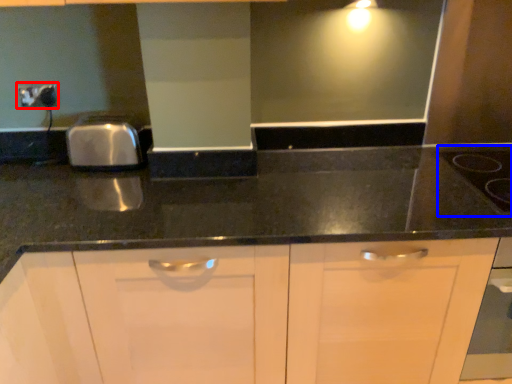
Question: Which of the following is the farthest to the observer, electric outlet (highlighted by a red box) or gas stove (highlighted by a blue box)?

Choices:
 (A) electric outlet
 (B) gas stove

Answer: (A)